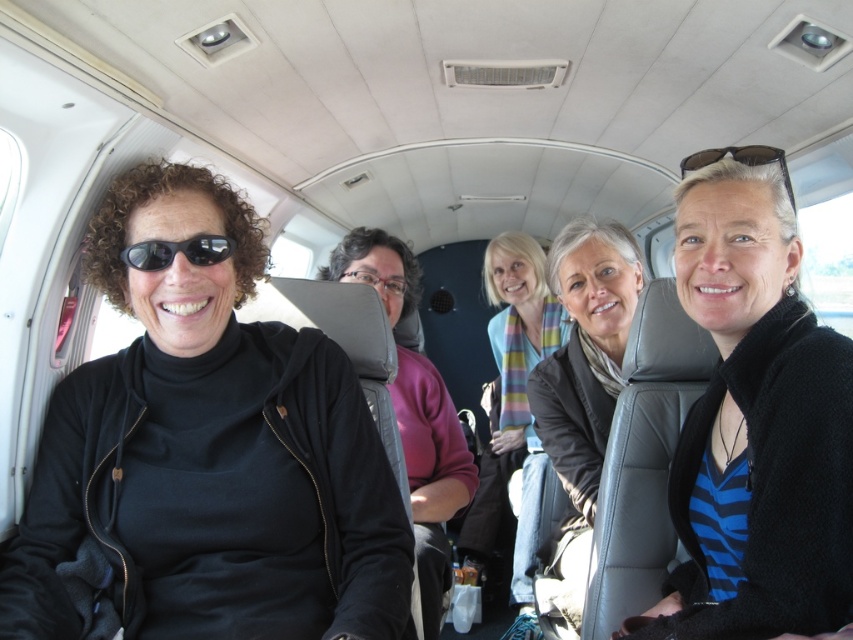
Question: Which object is the closest to the pink sweater at center?

Choices:
 (A) black knit sweater at center
 (B) black matte jacket at left
 (C) clear plastic glasses at center

Answer: (C)

Question: Which point is farther to the camera?

Choices:
 (A) (376, 520)
 (B) (195, 243)

Answer: (A)

Question: Can you confirm if black matte jacket at left is thinner than striped scarf at center?

Choices:
 (A) yes
 (B) no

Answer: (B)

Question: Can you confirm if striped scarf at center is positioned to the right of black matte sunglasses at left?

Choices:
 (A) yes
 (B) no

Answer: (A)

Question: Which point is farther to the camera?

Choices:
 (A) (343, 276)
 (B) (491, 288)

Answer: (B)

Question: Is the position of black matte jacket at left more distant than that of black knit sweater at center?

Choices:
 (A) yes
 (B) no

Answer: (A)